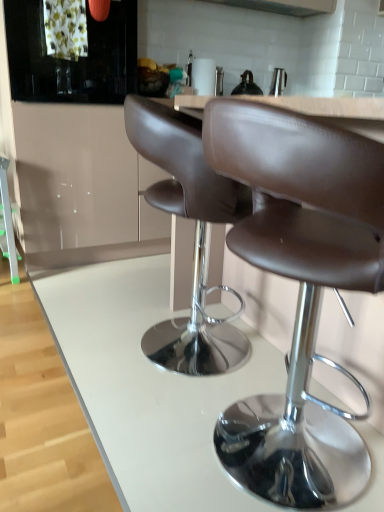
Where is `glossy white cabinet at upper left, the 2th cabinetry in the top-to-bottom sequence`? The image size is (384, 512). glossy white cabinet at upper left, the 2th cabinetry in the top-to-bottom sequence is located at coordinates (73, 176).

The height and width of the screenshot is (512, 384). What do you see at coordinates (299, 289) in the screenshot?
I see `brown leather stool at center` at bounding box center [299, 289].

What do you see at coordinates (72, 61) in the screenshot? I see `black glass cabinet at upper left, marked as the second cabinetry in a bottom-to-top arrangement` at bounding box center [72, 61].

Describe the element at coordinates (285, 6) in the screenshot. This screenshot has width=384, height=512. I see `satin silver exhaust hood at upper center` at that location.

What do you see at coordinates (7, 224) in the screenshot? The width and height of the screenshot is (384, 512). I see `green plastic ladder at left` at bounding box center [7, 224].

Describe the element at coordinates (149, 386) in the screenshot. I see `white glossy counter at center` at that location.

This screenshot has width=384, height=512. Identify the location of glossy white cabinet at upper left, the 2th cabinetry in the top-to-bottom sequence. (73, 176).

Is white glossy counter at center facing towards glossy white cabinet at upper left, the first cabinetry in the bottom-to-top sequence?

No, white glossy counter at center is not turned towards glossy white cabinet at upper left, the first cabinetry in the bottom-to-top sequence.

In terms of width, does white glossy counter at center look wider or thinner when compared to glossy white cabinet at upper left, the 2th cabinetry in the top-to-bottom sequence?

white glossy counter at center is wider than glossy white cabinet at upper left, the 2th cabinetry in the top-to-bottom sequence.

Considering their positions, is white glossy counter at center located in front of or behind glossy white cabinet at upper left, the 2th cabinetry in the top-to-bottom sequence?

Clearly, white glossy counter at center is in front of glossy white cabinet at upper left, the 2th cabinetry in the top-to-bottom sequence.

From the image's perspective, is white glossy counter at center positioned above or below glossy white cabinet at upper left, the 2th cabinetry in the top-to-bottom sequence?

Clearly, from the image's perspective, white glossy counter at center is below glossy white cabinet at upper left, the 2th cabinetry in the top-to-bottom sequence.

Is brown leather stool at center situated inside green plastic ladder at left or outside?

brown leather stool at center is not inside green plastic ladder at left, it's outside.

Can you confirm if brown leather stool at center is shorter than green plastic ladder at left?

No, brown leather stool at center is not shorter than green plastic ladder at left.

Which object is positioned more to the left, brown leather stool at center or green plastic ladder at left?

Positioned to the left is green plastic ladder at left.

Is point (288, 497) farther from camera compared to point (5, 170)?

No, it is in front of (5, 170).

Which of these two, glossy white cabinet at upper left, the 2th cabinetry in the top-to-bottom sequence, or green plastic ladder at left, stands shorter?

Standing shorter between the two is green plastic ladder at left.

Does glossy white cabinet at upper left, the 2th cabinetry in the top-to-bottom sequence, come behind green plastic ladder at left?

That is False.

In the scene shown: Can we say glossy white cabinet at upper left, the first cabinetry in the bottom-to-top sequence, lies outside green plastic ladder at left?

Yes, glossy white cabinet at upper left, the first cabinetry in the bottom-to-top sequence, is located beyond the bounds of green plastic ladder at left.

Would you say black glass cabinet at upper left, marked as the second cabinetry in a bottom-to-top arrangement, is inside or outside satin silver exhaust hood at upper center?

black glass cabinet at upper left, marked as the second cabinetry in a bottom-to-top arrangement, is spatially situated outside satin silver exhaust hood at upper center.

Which object is positioned more to the right, black glass cabinet at upper left, the 1th cabinetry from the top, or satin silver exhaust hood at upper center?

satin silver exhaust hood at upper center.

Who is smaller, black glass cabinet at upper left, marked as the second cabinetry in a bottom-to-top arrangement, or satin silver exhaust hood at upper center?

satin silver exhaust hood at upper center is smaller.

Considering the relative sizes of satin silver exhaust hood at upper center and brown leather stool at center in the image provided, is satin silver exhaust hood at upper center bigger than brown leather stool at center?

No, satin silver exhaust hood at upper center is not bigger than brown leather stool at center.

From the image's perspective, is satin silver exhaust hood at upper center above or below brown leather stool at center?

Based on their image positions, satin silver exhaust hood at upper center is located above brown leather stool at center.

From a real-world perspective, is satin silver exhaust hood at upper center above or below brown leather stool at center?

satin silver exhaust hood at upper center is above brown leather stool at center.

Would you say brown leather stool at center is to the left or to the right of glossy white cabinet at upper left, the 2th cabinetry in the top-to-bottom sequence, in the picture?

Clearly, brown leather stool at center is on the right of glossy white cabinet at upper left, the 2th cabinetry in the top-to-bottom sequence, in the image.

From the image's perspective, is brown leather stool at center located beneath glossy white cabinet at upper left, the 2th cabinetry in the top-to-bottom sequence?

Yes, from the image's perspective, brown leather stool at center is below glossy white cabinet at upper left, the 2th cabinetry in the top-to-bottom sequence.

The width and height of the screenshot is (384, 512). Find the location of `chair that is in front of the glossy white cabinet at upper left, the first cabinetry in the bottom-to-top sequence`. chair that is in front of the glossy white cabinet at upper left, the first cabinetry in the bottom-to-top sequence is located at coordinates (299, 289).

Is white glossy counter at center at the back of glossy white cabinet at upper left, the first cabinetry in the bottom-to-top sequence?

glossy white cabinet at upper left, the first cabinetry in the bottom-to-top sequence, does not have its back to white glossy counter at center.

Is glossy white cabinet at upper left, the first cabinetry in the bottom-to-top sequence, beside white glossy counter at center?

glossy white cabinet at upper left, the first cabinetry in the bottom-to-top sequence, and white glossy counter at center are not in contact.

In terms of width, does glossy white cabinet at upper left, the 2th cabinetry in the top-to-bottom sequence, look wider or thinner when compared to white glossy counter at center?

Clearly, glossy white cabinet at upper left, the 2th cabinetry in the top-to-bottom sequence, has less width compared to white glossy counter at center.

You are a GUI agent. You are given a task and a screenshot of the screen. Output one action in this format:
    pyautogui.click(x=<x>, y=<y>)
    Task: Click on the 2nd cabinetry to the left when counting from the white glossy counter at center
    The width and height of the screenshot is (384, 512).
    Given the screenshot: What is the action you would take?
    pyautogui.click(x=73, y=176)

The height and width of the screenshot is (512, 384). Identify the location of bar stool above the brown leather stool at center (from the image's perspective). (7, 224).

Looking at the image, which one is located further to black glass cabinet at upper left, marked as the second cabinetry in a bottom-to-top arrangement, white glossy counter at center or brown leather stool at center?

brown leather stool at center is positioned further to the anchor black glass cabinet at upper left, marked as the second cabinetry in a bottom-to-top arrangement.

Considering their positions, is green plastic ladder at left positioned further to brown leather stool at center than white glossy counter at center?

Among the two, green plastic ladder at left is located further to brown leather stool at center.

Looking at the image, which one is located further to satin silver exhaust hood at upper center, green plastic ladder at left or black glass cabinet at upper left, the 1th cabinetry from the top?

green plastic ladder at left is further to satin silver exhaust hood at upper center.

Estimate the real-world distances between objects in this image. Which object is closer to green plastic ladder at left, satin silver exhaust hood at upper center or white glossy counter at center?

white glossy counter at center lies closer to green plastic ladder at left than the other object.

Considering their positions, is brown leather stool at center positioned further to glossy white cabinet at upper left, the first cabinetry in the bottom-to-top sequence, than satin silver exhaust hood at upper center?

The object further to glossy white cabinet at upper left, the first cabinetry in the bottom-to-top sequence, is satin silver exhaust hood at upper center.

When comparing their distances from brown leather stool at center, does green plastic ladder at left or glossy white cabinet at upper left, the first cabinetry in the bottom-to-top sequence, seem further?

green plastic ladder at left lies further to brown leather stool at center than the other object.

From the image, which object appears to be farther from white glossy counter at center, black glass cabinet at upper left, the 1th cabinetry from the top, or glossy white cabinet at upper left, the first cabinetry in the bottom-to-top sequence?

black glass cabinet at upper left, the 1th cabinetry from the top, is further to white glossy counter at center.

Looking at the image, which one is located further to green plastic ladder at left, brown leather stool at center or white glossy counter at center?

brown leather stool at center is positioned further to the anchor green plastic ladder at left.

The width and height of the screenshot is (384, 512). In order to click on counter between brown leather stool at center and glossy white cabinet at upper left, the 2th cabinetry in the top-to-bottom sequence, from front to back in this screenshot , I will do `click(149, 386)`.

Locate an element on the screen. This screenshot has width=384, height=512. counter between brown leather stool at center and green plastic ladder at left from front to back is located at coordinates (149, 386).

Image resolution: width=384 pixels, height=512 pixels. I want to click on bar stool located between brown leather stool at center and satin silver exhaust hood at upper center in the depth direction, so click(7, 224).

Find the location of a particular element. The image size is (384, 512). cabinetry between black glass cabinet at upper left, the 1th cabinetry from the top, and green plastic ladder at left in the up-down direction is located at coordinates (73, 176).